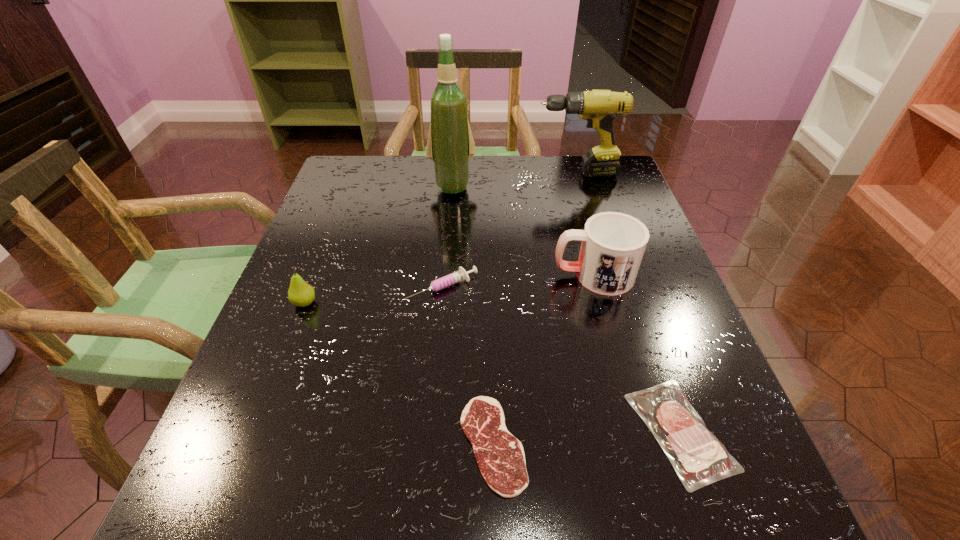
Find the location of a particular element. the tallest object is located at coordinates (450, 144).

Locate an element on the screen. This screenshot has height=540, width=960. the second tallest object is located at coordinates (599, 107).

Where is `the third tallest object`? This screenshot has height=540, width=960. the third tallest object is located at coordinates (613, 244).

Image resolution: width=960 pixels, height=540 pixels. In order to click on the leftmost object in this screenshot , I will do `click(301, 294)`.

What are the coordinates of `pear` in the screenshot? It's located at (x=301, y=294).

Image resolution: width=960 pixels, height=540 pixels. In order to click on the fifth tallest object in this screenshot , I will do `click(460, 275)`.

Where is `the taller steak`? The width and height of the screenshot is (960, 540). the taller steak is located at coordinates (696, 455).

Identify the location of the sixth tallest object. The height and width of the screenshot is (540, 960). (696, 455).

At what (x,y) coordinates should I click in order to perform the action: click on the left steak. Please return your answer as a coordinate pair (x, y). Looking at the image, I should click on (500, 456).

At what (x,y) coordinates should I click in order to perform the action: click on the shorter steak. Please return your answer as a coordinate pair (x, y). The height and width of the screenshot is (540, 960). Looking at the image, I should click on (500, 456).